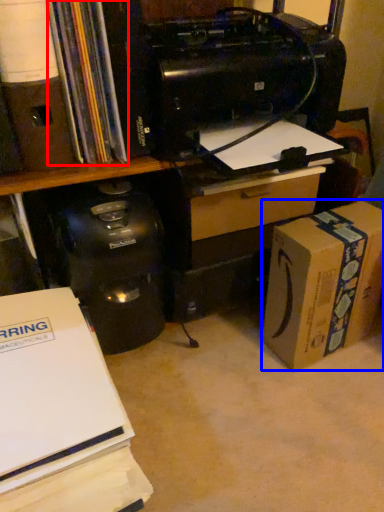
Question: Which object appears farthest to the camera in this image, book (highlighted by a red box) or box (highlighted by a blue box)?

Choices:
 (A) book
 (B) box

Answer: (B)